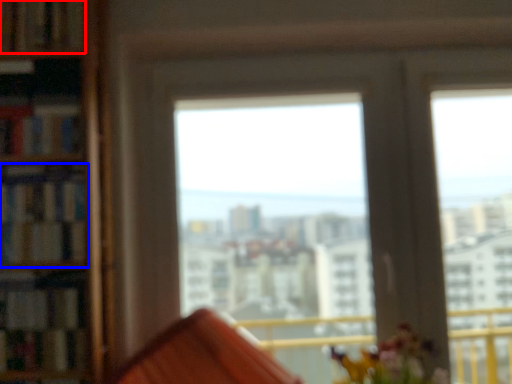
Question: Which object appears farthest to the camera in this image, book (highlighted by a red box) or book (highlighted by a blue box)?

Choices:
 (A) book
 (B) book

Answer: (A)